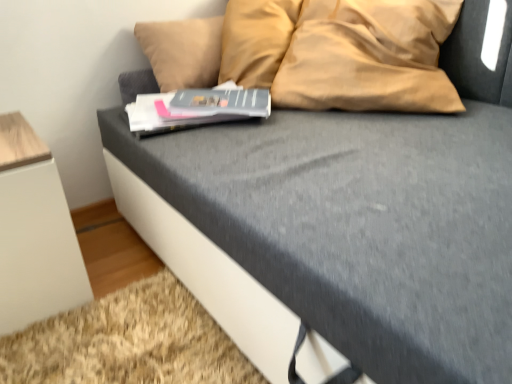
The image size is (512, 384). Find the location of `vacant area on top of hardcover book at center, arranged as the second paperback book when viewed from the back (from a real-world perspective)`. vacant area on top of hardcover book at center, arranged as the second paperback book when viewed from the back (from a real-world perspective) is located at coordinates (194, 101).